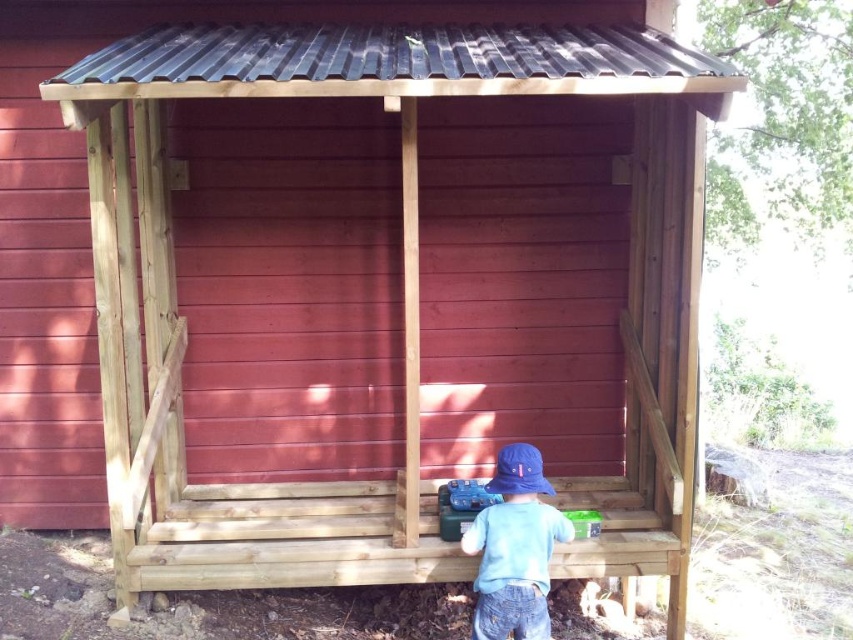
Question: Is light blue cotton shirt at center closer to the viewer compared to blue fabric baseball hat at lower center?

Choices:
 (A) no
 (B) yes

Answer: (B)

Question: Among these objects, which one is farthest from the camera?

Choices:
 (A) light blue cotton shirt at center
 (B) blue fabric baseball hat at lower center

Answer: (B)

Question: Is light blue cotton shirt at center thinner than blue fabric baseball hat at lower center?

Choices:
 (A) no
 (B) yes

Answer: (A)

Question: Is light blue cotton shirt at center bigger than blue fabric baseball hat at lower center?

Choices:
 (A) yes
 (B) no

Answer: (A)

Question: Which point is farther from the camera taking this photo?

Choices:
 (A) (508, 481)
 (B) (547, 547)

Answer: (A)